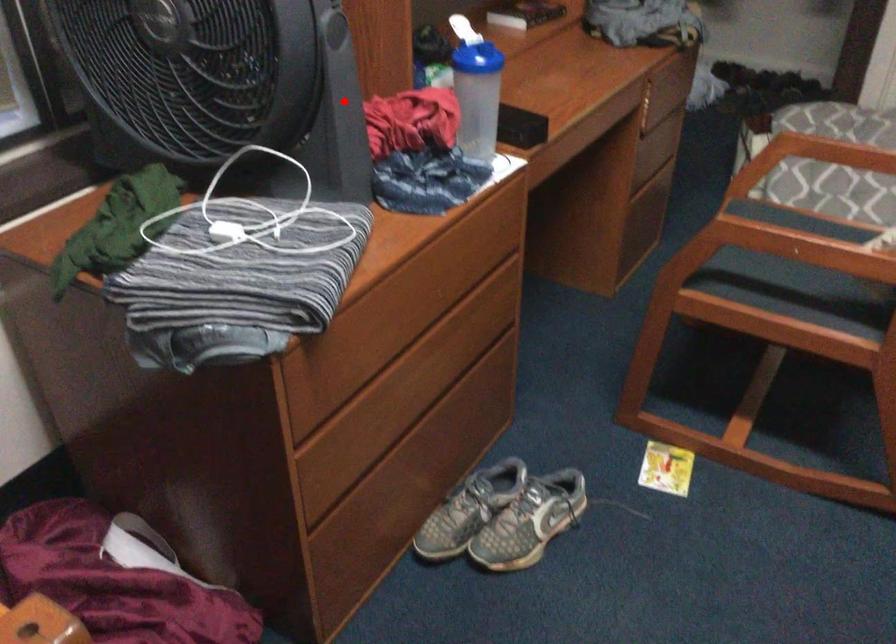
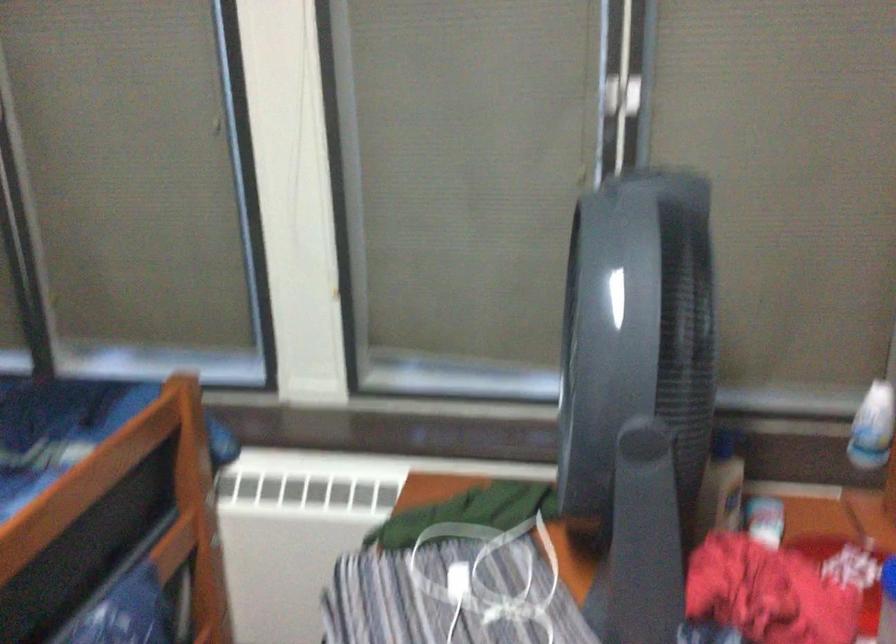
Question: I am providing you with two images of the same scene from different viewpoints. A red point is marked on the first image. Can you still see the location of the red point in image 2?

Choices:
 (A) Yes
 (B) No

Answer: (A)